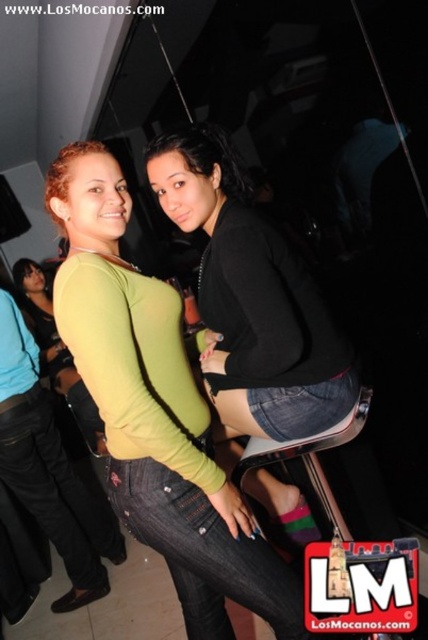
Question: Can you confirm if green matte shirt at center is thinner than black denim shorts at center?

Choices:
 (A) no
 (B) yes

Answer: (A)

Question: Which object is farther from the camera taking this photo?

Choices:
 (A) green matte shirt at center
 (B) black denim shorts at center

Answer: (B)

Question: Can you confirm if green matte shirt at center is positioned above black denim shorts at center?

Choices:
 (A) no
 (B) yes

Answer: (A)

Question: Among these points, which one is farthest from the camera?

Choices:
 (A) (317, 372)
 (B) (104, 234)

Answer: (A)

Question: Which of the following is the closest to the observer?

Choices:
 (A) (175, 340)
 (B) (219, 150)

Answer: (A)

Question: Where is green matte shirt at center located in relation to black denim shorts at center in the image?

Choices:
 (A) left
 (B) right

Answer: (A)